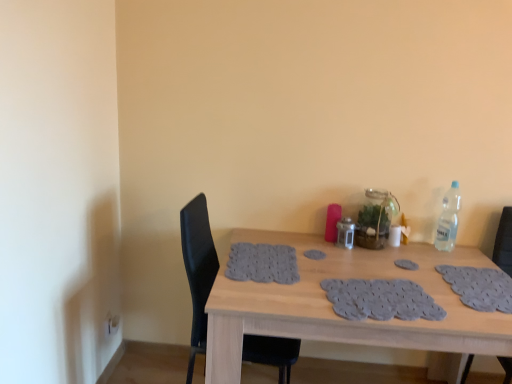
Where is `empty space that is to the right of gray fabric footprint at center, placed as the 1th footprint when sorted from left to right`? empty space that is to the right of gray fabric footprint at center, placed as the 1th footprint when sorted from left to right is located at coordinates (359, 258).